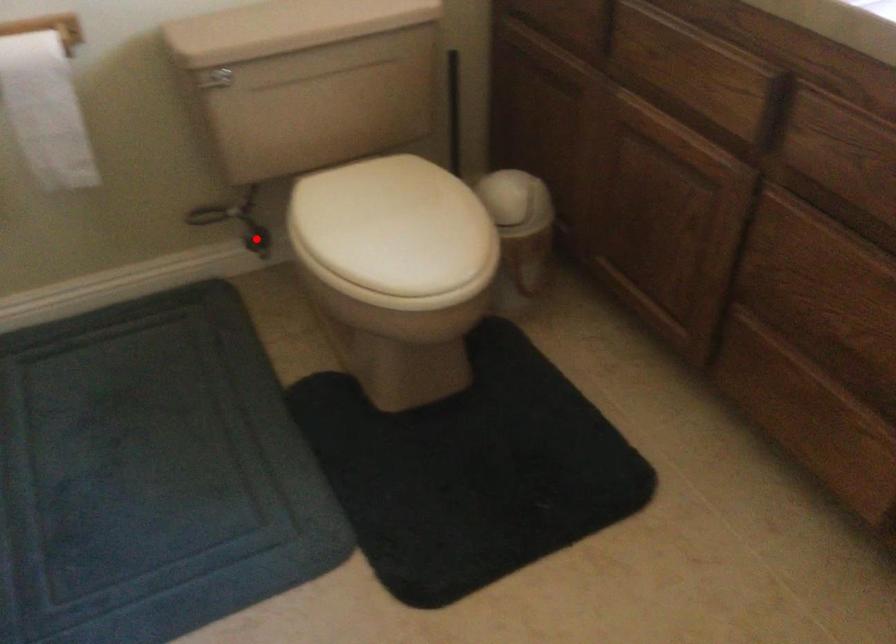
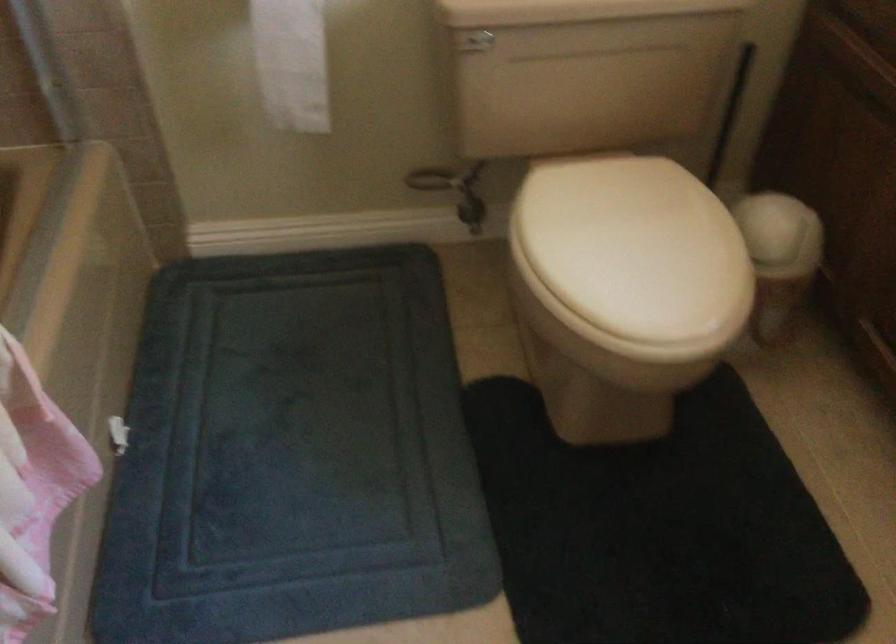
Locate, in the second image, the point that corresponds to the highlighted location in the first image.

(471, 211)